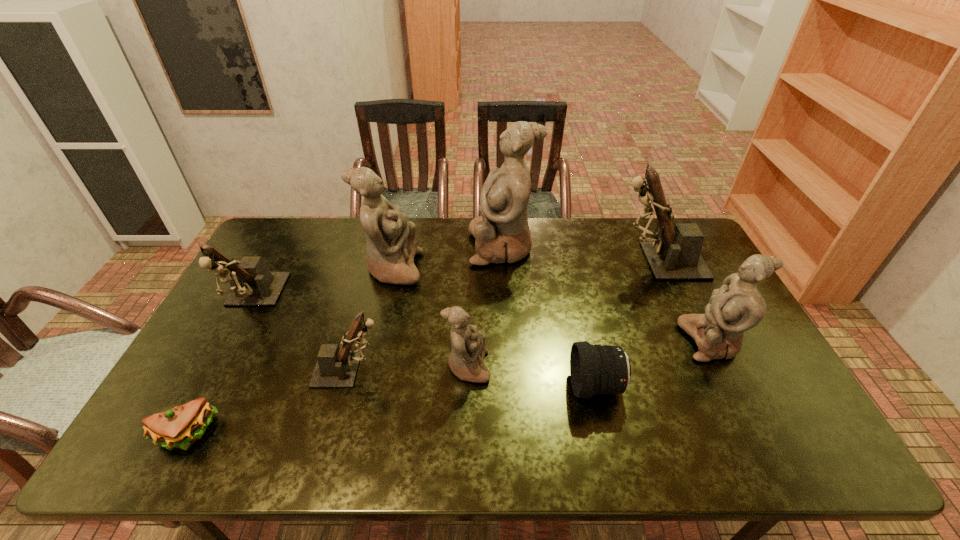
Where is `black telephoto lens`? black telephoto lens is located at coordinates (594, 369).

You are a GUI agent. You are given a task and a screenshot of the screen. Output one action in this format:
    pyautogui.click(x=<x>, y=<y>)
    Task: Click on the telephoto lens
    
    Given the screenshot: What is the action you would take?
    pyautogui.click(x=594, y=369)

Find the location of a particular element. This screenshot has width=960, height=540. the shortest object is located at coordinates (180, 427).

The image size is (960, 540). In order to click on sandwich in this screenshot , I will do `click(180, 427)`.

The image size is (960, 540). What are the coordinates of `free space located on the front-facing side of the tallest figurine` in the screenshot? It's located at (423, 246).

At what (x,y) coordinates should I click in order to perform the action: click on vacant region located 0.350m on the front-facing side of the tallest figurine. Please return your answer as a coordinate pair (x, y). Image resolution: width=960 pixels, height=540 pixels. Looking at the image, I should click on (370, 246).

Locate an element on the screen. This screenshot has width=960, height=540. blank space located on the front-facing side of the tallest figurine is located at coordinates click(x=381, y=246).

Locate an element on the screen. This screenshot has width=960, height=540. vacant space located 0.340m on the front-facing side of the second biggest white figurine is located at coordinates (524, 268).

At what (x,y) coordinates should I click in order to perform the action: click on vacant area situated on the front-facing side of the rightmost brown figurine. Please return your answer as a coordinate pair (x, y). This screenshot has height=540, width=960. Looking at the image, I should click on (504, 261).

Identify the location of vacant space located on the front-facing side of the rightmost brown figurine. (577, 261).